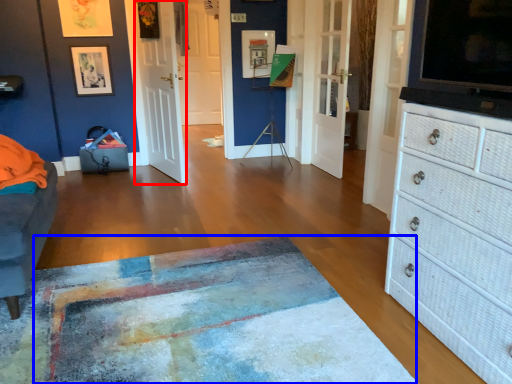
Question: Which point is closer to the camera, door (highlighted by a red box) or mat (highlighted by a blue box)?

Choices:
 (A) door
 (B) mat

Answer: (B)